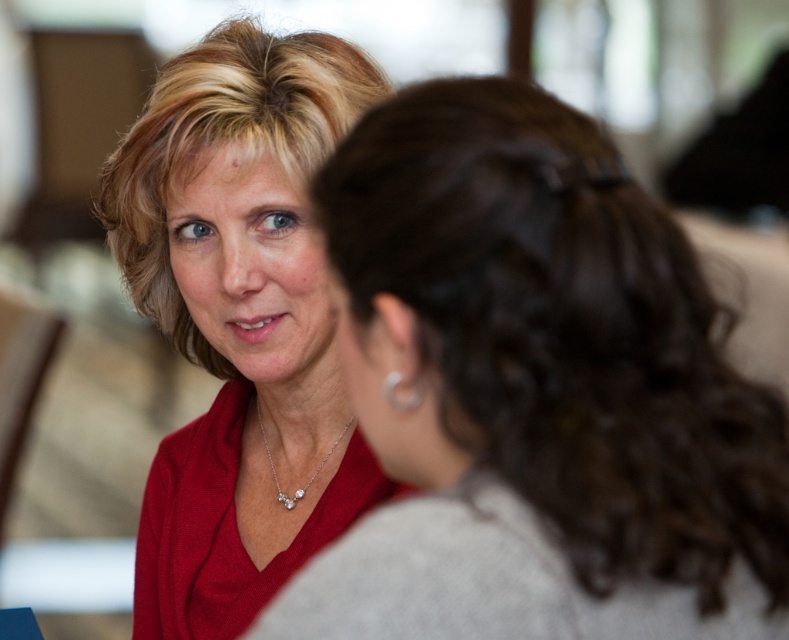
Question: Is matte red blouse at upper left positioned before matte red blouse at center?

Choices:
 (A) yes
 (B) no

Answer: (A)

Question: Is matte red blouse at center above silver metallic earring at upper right?

Choices:
 (A) no
 (B) yes

Answer: (B)

Question: Which point is closer to the camera?

Choices:
 (A) silver metallic earring at upper right
 (B) matte red blouse at upper left
 (C) matte red blouse at center

Answer: (B)

Question: Which point appears closest to the camera in this image?

Choices:
 (A) (380, 148)
 (B) (387, 385)
 (C) (255, 396)

Answer: (A)

Question: Which point is closer to the camera?

Choices:
 (A) (253, 189)
 (B) (724, 593)

Answer: (B)

Question: Is matte red blouse at upper left smaller than matte red blouse at center?

Choices:
 (A) yes
 (B) no

Answer: (A)